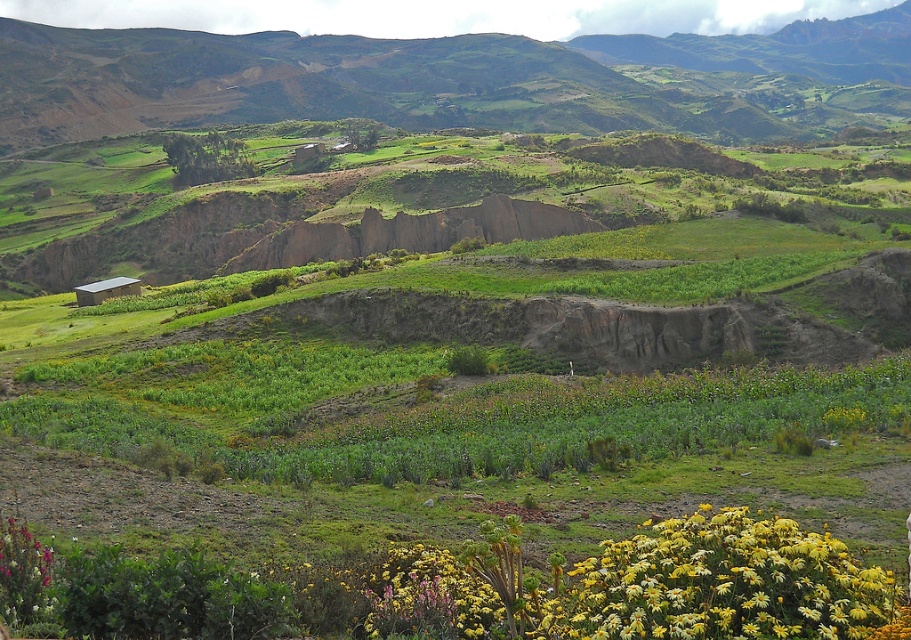
Can you confirm if green grassy hill at upper center is positioned to the right of yellow matte flower at lower right?

Yes, green grassy hill at upper center is to the right of yellow matte flower at lower right.

Is green grassy hill at upper center taller than yellow matte flower at lower right?

Indeed, green grassy hill at upper center has a greater height compared to yellow matte flower at lower right.

Is point (730, 40) farther from viewer compared to point (733, 609)?

Yes, point (730, 40) is farther from viewer.

The image size is (911, 640). Identify the location of green grassy hill at upper center. (449, 80).